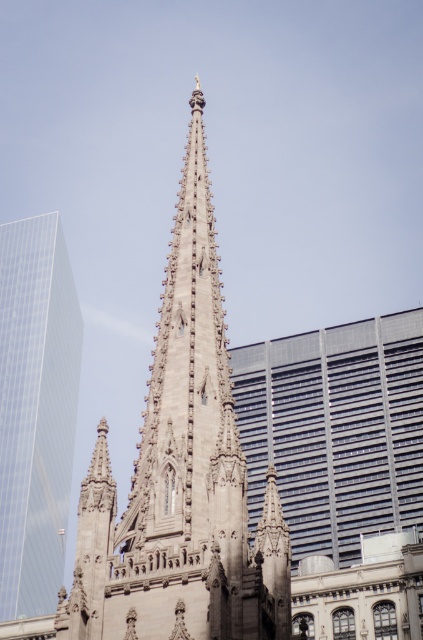
Looking at this image, you are standing at the origin point in the image. Which direction should you look to see the brown stone tower at center?

The brown stone tower at center is located at point (181, 476), so you should look towards the upper right direction from the origin point.

You are standing in the city square and want to take a photo of the brown stone tower at center and the transparent glass skyscraper at left. Which one will appear larger in the photo?

The brown stone tower at center will appear larger in the photo because it is closer to the viewer than the transparent glass skyscraper at left.